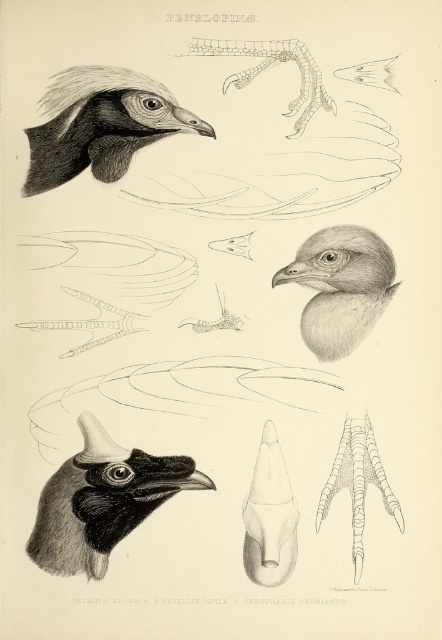
Question: In this image, where is smooth black head at upper left located relative to smooth gray head at center?

Choices:
 (A) above
 (B) below

Answer: (A)

Question: Considering the real-world distances, which object is closest to the black matte head at lower left?

Choices:
 (A) smooth gray head at center
 (B) smooth black head at upper left

Answer: (A)

Question: Is black matte head at lower left thinner than smooth gray head at center?

Choices:
 (A) no
 (B) yes

Answer: (A)

Question: Does black matte head at lower left appear over smooth gray head at center?

Choices:
 (A) no
 (B) yes

Answer: (A)

Question: Which point is closer to the camera taking this photo?

Choices:
 (A) (128, 136)
 (B) (83, 529)
 (C) (339, 336)

Answer: (B)

Question: Which point appears closest to the camera in this image?

Choices:
 (A) (53, 536)
 (B) (350, 314)
 (C) (84, 77)

Answer: (A)